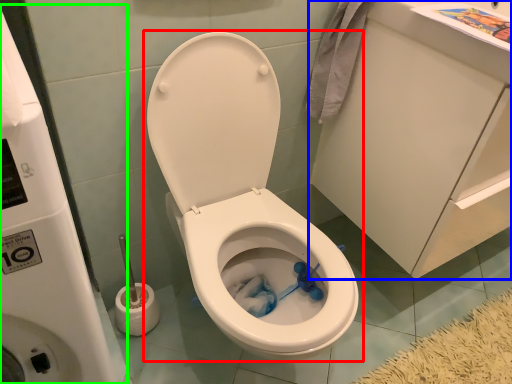
Question: Which object is positioned closest to toilet (highlighted by a red box)? Select from porcelain (highlighted by a blue box) and water tank (highlighted by a green box).

Choices:
 (A) porcelain
 (B) water tank

Answer: (A)